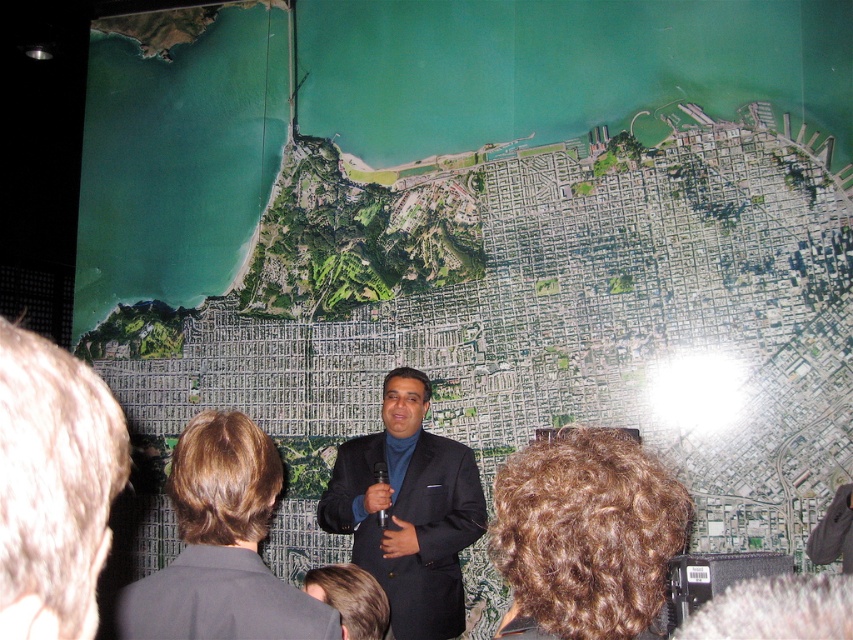
Between black suit at center and matte black suit at center, which one has less height?

With less height is black suit at center.

The image size is (853, 640). I want to click on black suit at center, so click(221, 547).

The height and width of the screenshot is (640, 853). I want to click on black suit at center, so click(x=221, y=547).